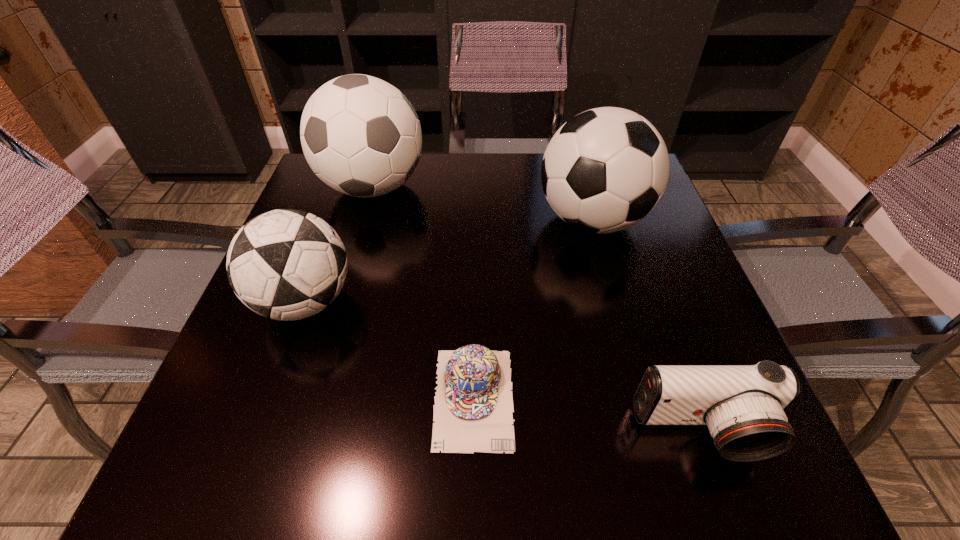
Where is `the rightmost soccer ball`? The height and width of the screenshot is (540, 960). the rightmost soccer ball is located at coordinates (604, 170).

Find the location of a particular element. This screenshot has height=540, width=960. the nearest soccer ball is located at coordinates (286, 264).

The height and width of the screenshot is (540, 960). Identify the location of the third nearest object. (286, 264).

Identify the location of camcorder. The height and width of the screenshot is (540, 960). (743, 406).

The height and width of the screenshot is (540, 960). Find the location of `the third object from right to left`. the third object from right to left is located at coordinates (473, 408).

I want to click on cap, so click(473, 408).

At what (x,y) coordinates should I click in order to perform the action: click on vacant region located 0.090m on the back of the rightmost soccer ball. Please return your answer as a coordinate pair (x, y). This screenshot has width=960, height=540. Looking at the image, I should click on (578, 169).

The height and width of the screenshot is (540, 960). Find the location of `free space located 0.180m on the surface of the shortest soccer ball where the brand logo is visible`. free space located 0.180m on the surface of the shortest soccer ball where the brand logo is visible is located at coordinates (445, 301).

Locate an element on the screen. This screenshot has height=540, width=960. camcorder that is at the near edge is located at coordinates (743, 406).

Where is `cap that is positioned at the near edge`? cap that is positioned at the near edge is located at coordinates (473, 408).